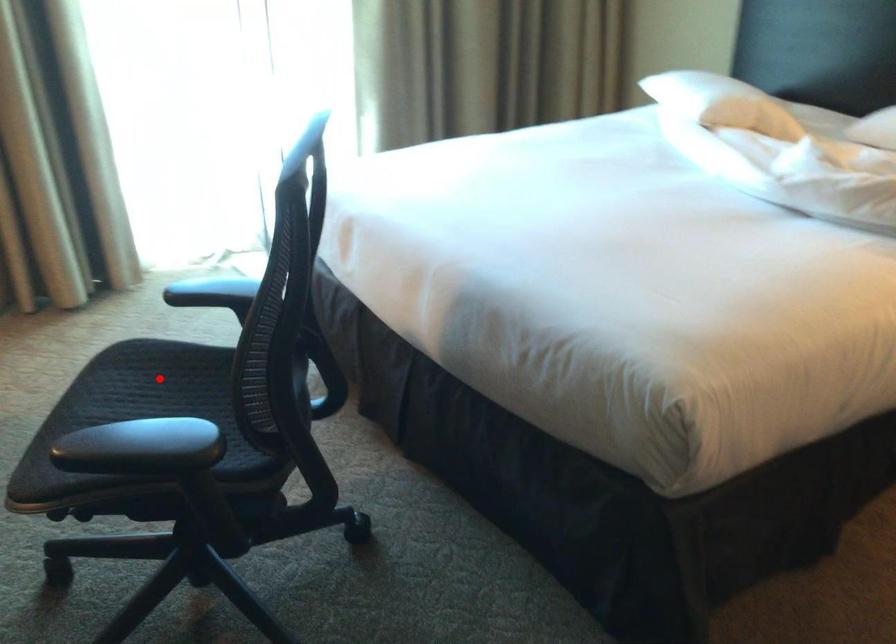
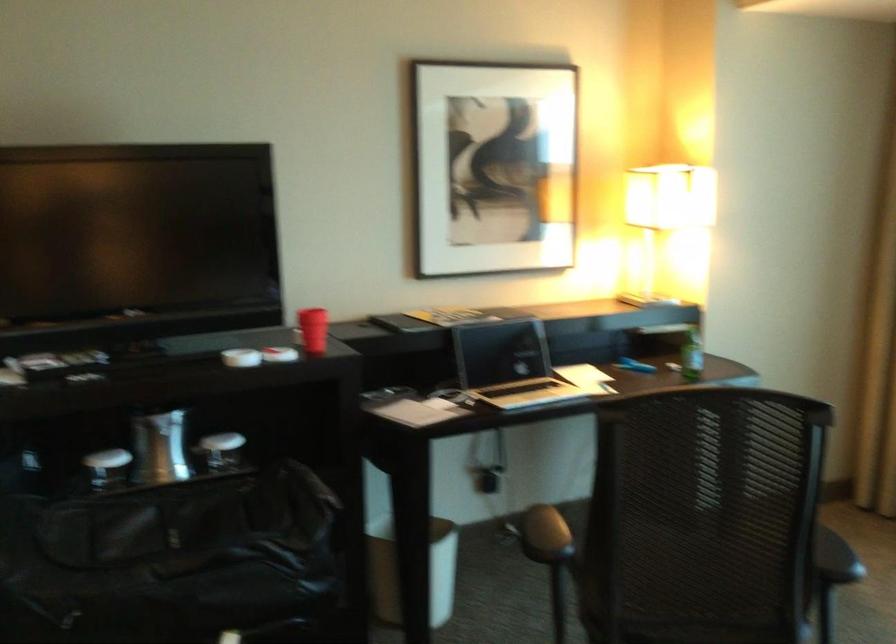
Question: I am providing you with two images of the same scene from different viewpoints. A red point is marked on the first image. At the location where the point appears in image 1, is it still visible in image 2?

Choices:
 (A) Yes
 (B) No

Answer: (B)